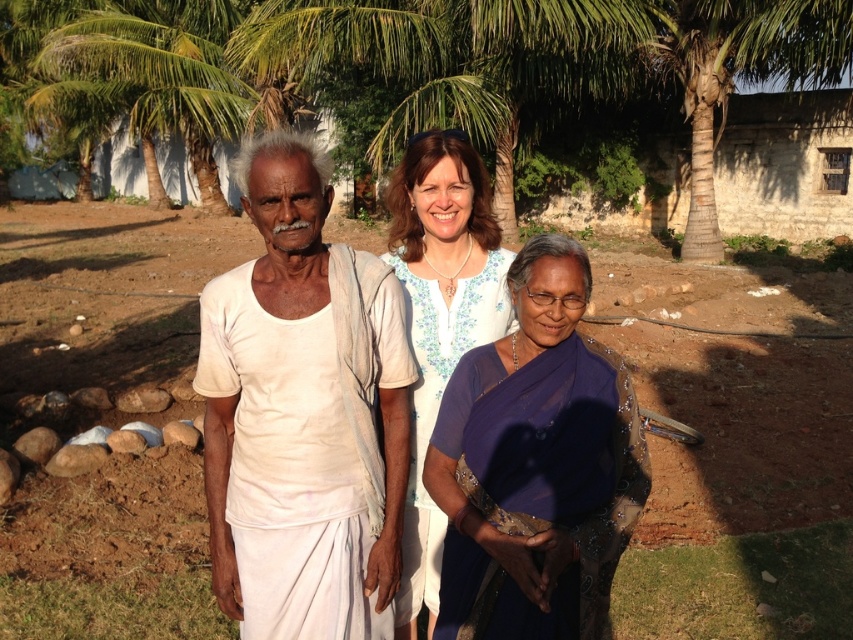
You are standing in a rural setting and see three people. The first person on the left is wearing a white t shirt and light dhoti, the center person is wearing a white dress with blue flowers, and the right person is in a dark purple saree. You have a gift for the person wearing the white cotton shirt at center. Where should you aim to place the gift so it reaches them accurately?

The white cotton shirt at center is located at the coordinates (302,413), so you should aim to place the gift at that 2D point to ensure it reaches the correct person.

In the scene shown: You are a photographer trying to capture a clear shot of the purple sheer saree at center without the green leafy tree at upper center blocking it. Given their sizes, can you suggest a way to adjust your position or angle to achieve this?

The green leafy tree at upper center is bigger than the purple sheer saree at center, so you can move closer to the purple sheer saree at center to reduce the tree size in the frame or angle the camera downward to avoid the tree obstructing the saree.

Consider the image. In the image, there are three people standing outdoors. The first person on the left is an older man in a white tshirt and light dhoti. The center person is a woman in a white dress with blue flowers. The third person on the right is wearing a dark purple saree. There is a point marked at coordinate (x=302, y=413). Which object is located at this coordinate?

The point at coordinate (x=302, y=413) indicates the white cotton shirt at center.